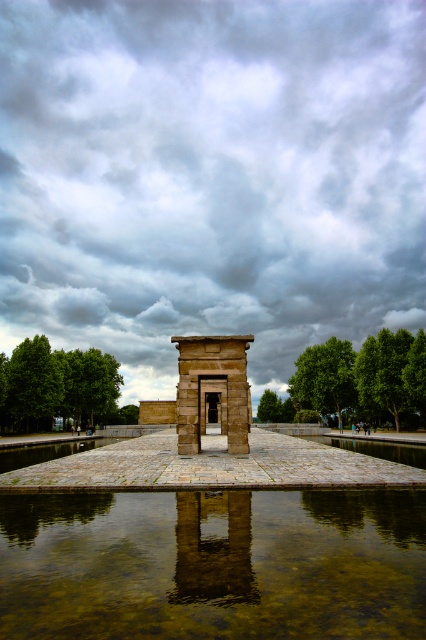
What do you see at coordinates (210, 177) in the screenshot?
I see `cloudy sky at upper center` at bounding box center [210, 177].

Between point (5, 292) and point (186, 442), which one is positioned in front?

Positioned in front is point (186, 442).

Locate an element on the screen. The image size is (426, 640). cloudy sky at upper center is located at coordinates (210, 177).

I want to click on cloudy sky at upper center, so click(210, 177).

Can you confirm if cloudy sky at upper center is bigger than clear water at center?

Indeed, cloudy sky at upper center has a larger size compared to clear water at center.

Does cloudy sky at upper center appear over clear water at center?

Yes.

What do you see at coordinates (210, 177) in the screenshot?
I see `cloudy sky at upper center` at bounding box center [210, 177].

Find the location of a particular element. The width and height of the screenshot is (426, 640). cloudy sky at upper center is located at coordinates (x=210, y=177).

Find the location of `clear water at center`. clear water at center is located at coordinates (213, 564).

Does point (77, 545) come closer to viewer compared to point (195, 417)?

Yes, it is in front of point (195, 417).

Image resolution: width=426 pixels, height=640 pixels. In order to click on clear water at center in this screenshot , I will do `click(213, 564)`.